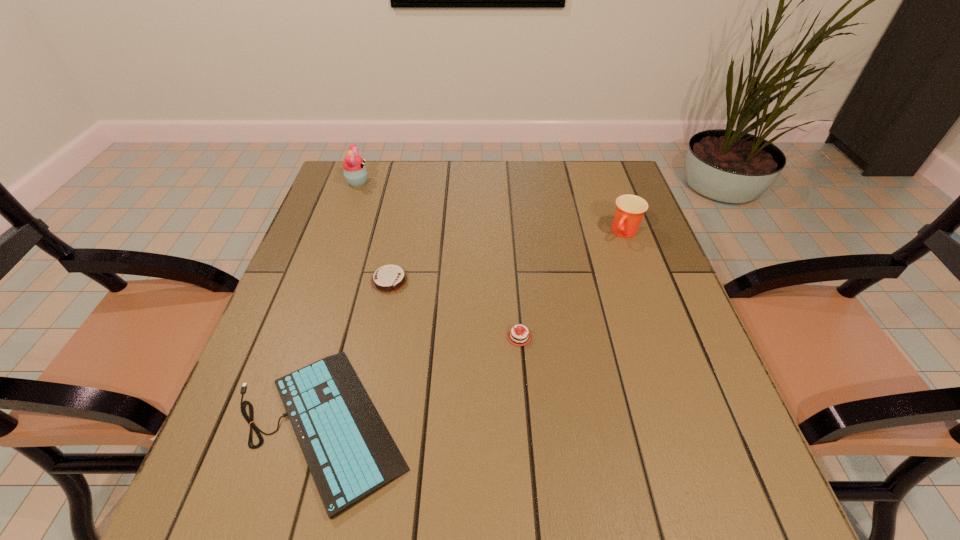
Locate an element on the screen. object at the near left corner is located at coordinates (350, 453).

You are a GUI agent. You are given a task and a screenshot of the screen. Output one action in this format:
    pyautogui.click(x=<x>, y=<y>)
    Task: Click on the vacant region at the far edge of the desktop
    
    Given the screenshot: What is the action you would take?
    pyautogui.click(x=407, y=185)

In the image, there is a desktop. Where is `vacant area at the near edge`? The height and width of the screenshot is (540, 960). vacant area at the near edge is located at coordinates (532, 498).

Locate an element on the screen. The width and height of the screenshot is (960, 540). vacant space at the left edge of the desktop is located at coordinates (308, 305).

This screenshot has height=540, width=960. In the image, there is a desktop. In order to click on vacant space at the right edge in this screenshot , I will do `click(661, 288)`.

The image size is (960, 540). In order to click on free location at the far right corner in this screenshot , I will do `click(596, 163)`.

I want to click on vacant space that's between the second farthest object and the tallest object, so click(492, 207).

The width and height of the screenshot is (960, 540). What are the coordinates of `free space between the cupcake and the farther chocolate cake` in the screenshot? It's located at (373, 232).

You are a GUI agent. You are given a task and a screenshot of the screen. Output one action in this format:
    pyautogui.click(x=<x>, y=<y>)
    Task: Click on the vacant space that is in between the fourth object from left to right and the computer keyboard
    
    Given the screenshot: What is the action you would take?
    pyautogui.click(x=420, y=381)

Identify the location of free area in between the second tallest object and the cupcake. The height and width of the screenshot is (540, 960). (492, 207).